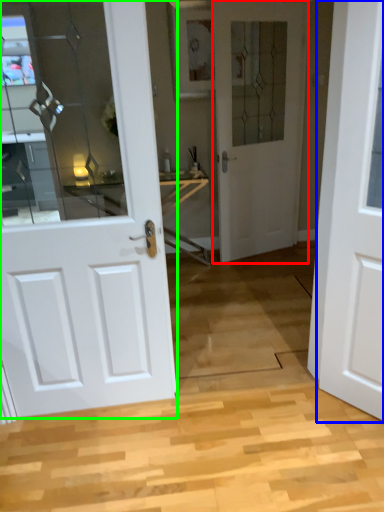
Question: Considering the real-world distances, which object is closest to door (highlighted by a red box)? door (highlighted by a blue box) or door (highlighted by a green box).

Choices:
 (A) door
 (B) door

Answer: (A)